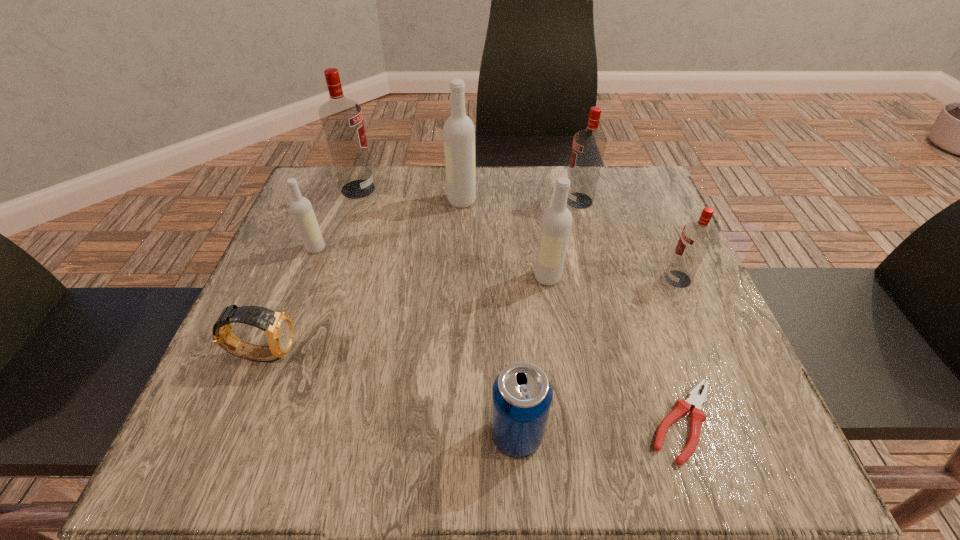
This screenshot has width=960, height=540. What are the coordinates of `free space in the image that satisfies the following two spatial constraints: 1. on the front label of the second red vodka from right to left; 2. on the front side of the blue pop soda` in the screenshot? It's located at (639, 435).

Where is `free point that satisfies the following two spatial constraints: 1. on the back side of the pop soda; 2. on the front label of the leftmost red vodka`? free point that satisfies the following two spatial constraints: 1. on the back side of the pop soda; 2. on the front label of the leftmost red vodka is located at coordinates (502, 189).

You are a GUI agent. You are given a task and a screenshot of the screen. Output one action in this format:
    pyautogui.click(x=<x>, y=<y>)
    Task: Click on the vacant space that satisfies the following two spatial constraints: 1. on the back side of the shortest object; 2. on the front label of the leftmost red vodka
    
    Given the screenshot: What is the action you would take?
    pyautogui.click(x=605, y=189)

Find the location of a particular element. The height and width of the screenshot is (540, 960). vacant area that satisfies the following two spatial constraints: 1. on the face of the blue pop soda; 2. on the right side of the second shortest object is located at coordinates (231, 435).

This screenshot has width=960, height=540. I want to click on free location that satisfies the following two spatial constraints: 1. on the face of the watch; 2. on the back side of the shortest object, so click(x=236, y=422).